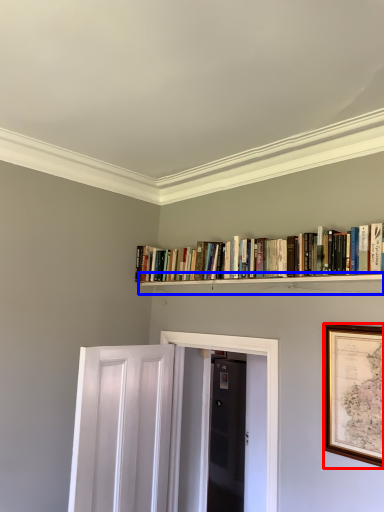
Question: Among these objects, which one is farthest to the camera, picture frame (highlighted by a red box) or shelf (highlighted by a blue box)?

Choices:
 (A) picture frame
 (B) shelf

Answer: (B)